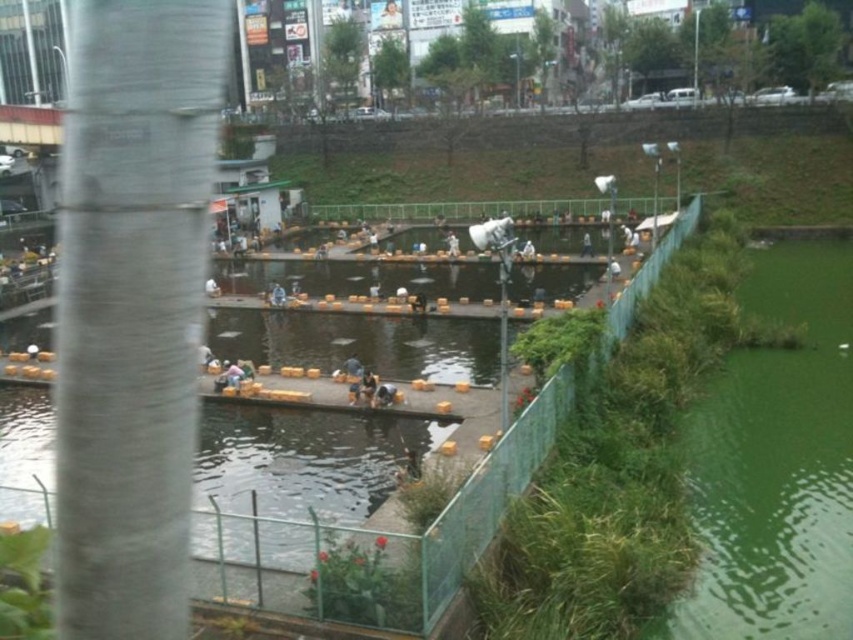
You are standing at the center of the image and want to place a new object exactly where the light brown wooden chair at center is located. What are the coordinates you should aim for?

The coordinates for the light brown wooden chair at center are 0.586 in the x direction and 0.272 in the y direction.

You are a photographer planning to capture a photo of the green liquid water at lower right and the light brown wooden chair at center. Which object should you focus on first if you want to include both in your shot without moving the camera?

The green liquid water at lower right should be focused on first since it has a larger size compared to the light brown wooden chair at center, allowing it to take up more space in the frame while still including the smaller chair.

You are a visitor standing on the wooden platforms near the water. You need to sit down but there are only two options available. The light brown wooden chair at center and the dark blue fabric person at center. Which one is taller and thus more suitable for sitting?

The light brown wooden chair at center is taller than the dark blue fabric person at center, so it is more suitable for sitting.